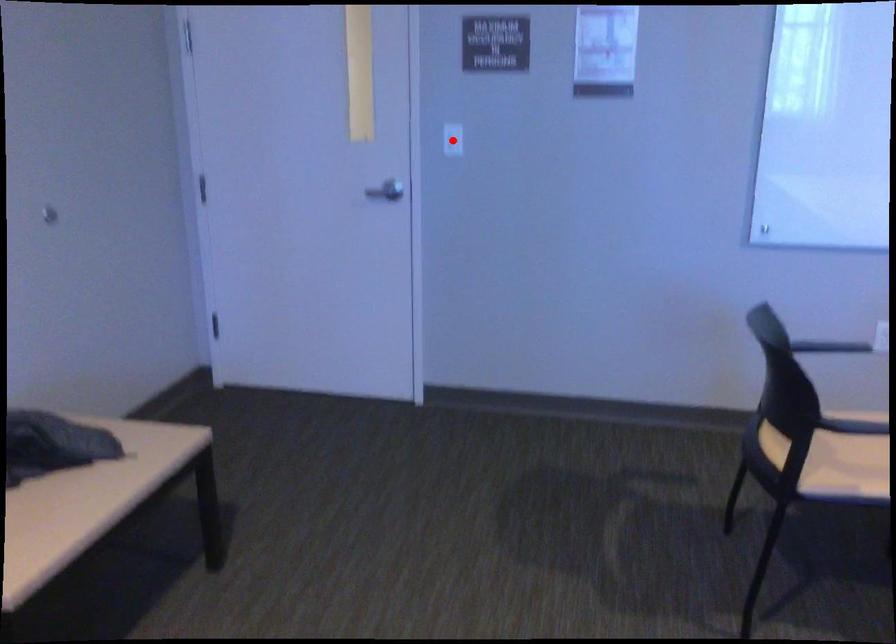
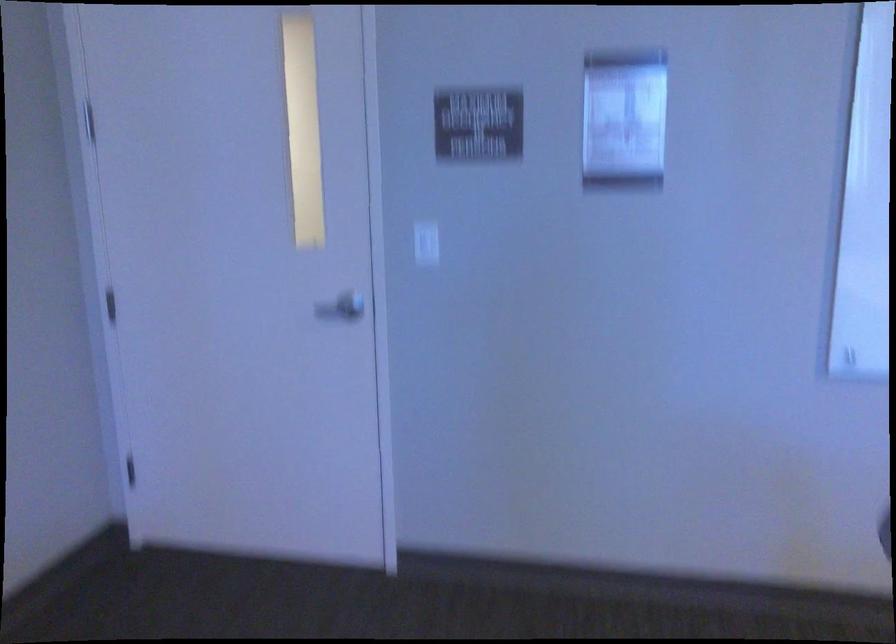
The point at the highlighted location is marked in the first image. Where is the corresponding point in the second image?

(426, 243)